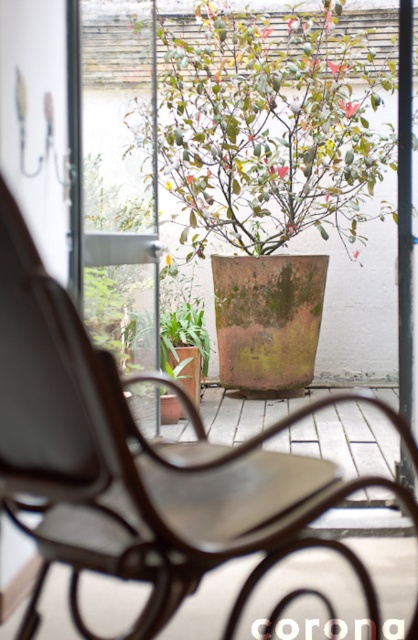
Can you confirm if rustic wood rocking chair at center is positioned above green matte pot at center?

Incorrect, rustic wood rocking chair at center is not positioned above green matte pot at center.

Is rustic wood rocking chair at center positioned in front of green matte pot at center?

That is True.

Where is `rustic wood rocking chair at center`? The height and width of the screenshot is (640, 418). rustic wood rocking chair at center is located at coordinates tap(139, 461).

This screenshot has width=418, height=640. In order to click on rustic wood rocking chair at center in this screenshot , I will do `click(139, 461)`.